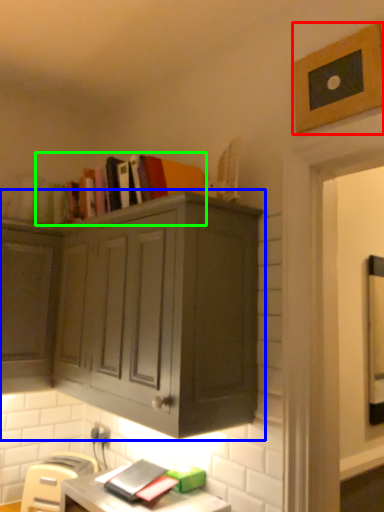
Question: Which object is positioned farthest from picture frame (highlighted by a red box)? Select from cabinetry (highlighted by a blue box) and book (highlighted by a green box).

Choices:
 (A) cabinetry
 (B) book

Answer: (A)